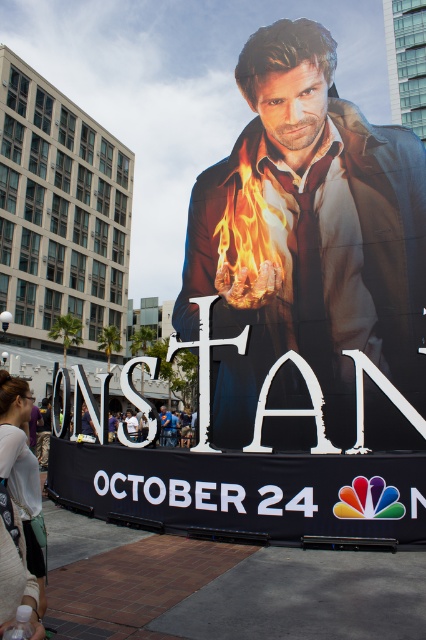
Is the position of smooth leather jacket at center less distant than that of white textured shirt at lower left?

No, it is behind white textured shirt at lower left.

Looking at this image, how much distance is there between smooth leather jacket at center and white textured shirt at lower left?

smooth leather jacket at center is 3.89 meters away from white textured shirt at lower left.

What do you see at coordinates (310, 237) in the screenshot? The image size is (426, 640). I see `smooth leather jacket at center` at bounding box center [310, 237].

You are a GUI agent. You are given a task and a screenshot of the screen. Output one action in this format:
    pyautogui.click(x=<x>, y=<y>)
    Task: Click on the smooth leather jacket at center
    This screenshot has height=640, width=426.
    Given the screenshot: What is the action you would take?
    pyautogui.click(x=310, y=237)